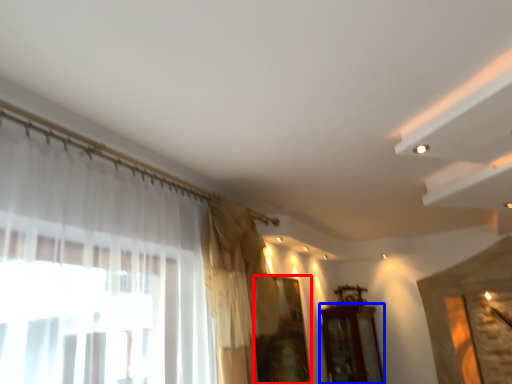
Question: Which object is closer to the camera taking this photo, window (highlighted by a red box) or furniture (highlighted by a blue box)?

Choices:
 (A) window
 (B) furniture

Answer: (A)